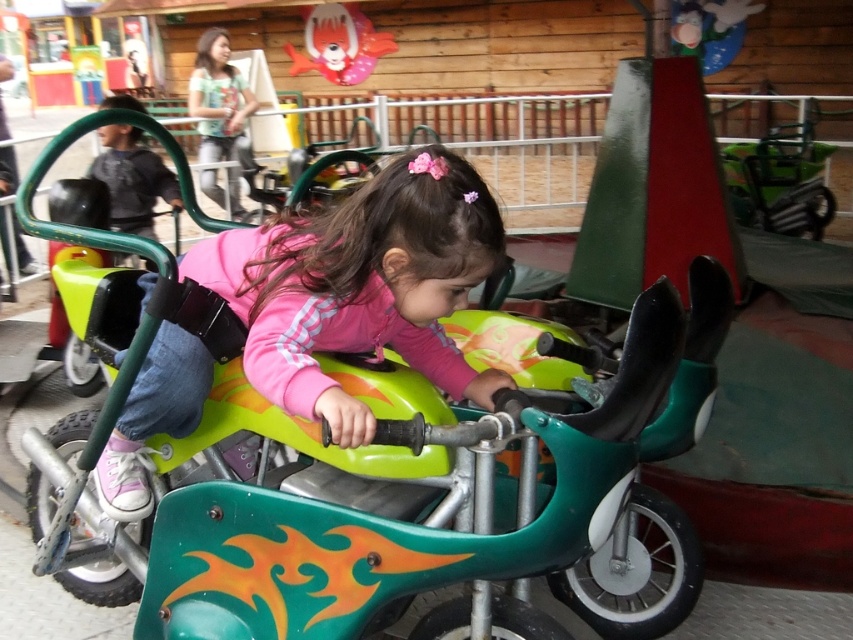
Does matte green motorcycle at center have a greater height compared to shiny plastic balloon at upper center?

No, matte green motorcycle at center is not taller than shiny plastic balloon at upper center.

Where is `matte green motorcycle at center`? This screenshot has width=853, height=640. matte green motorcycle at center is located at coordinates (360, 285).